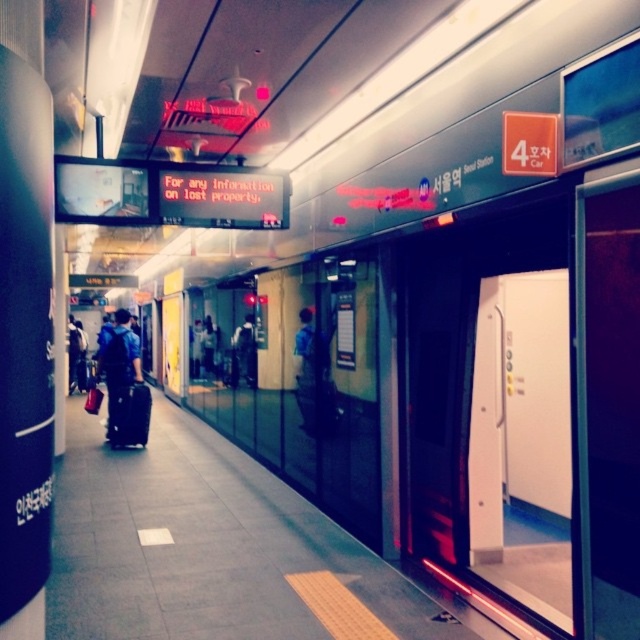
You are a traveler waiting for your train at the subway station. You have a blue fabric backpack at center and a black fabric suitcase at center near you. You want to place both items on the train shelf above the seats. The shelf is 20 inches wide. Can both items fit side by side on the shelf?

The blue fabric backpack at center and black fabric suitcase at center are 19.08 inches apart from each other. Since the shelf is 20 inches wide, there is enough space for both items to fit side by side on the shelf.

You are standing on the subway platform and see two points marked on the floor. The first point is at coordinates point (115, 387) and the second is at point (236, 348). Which point is closer to you?

Point (115, 387) is closer to the viewer than point (236, 348).